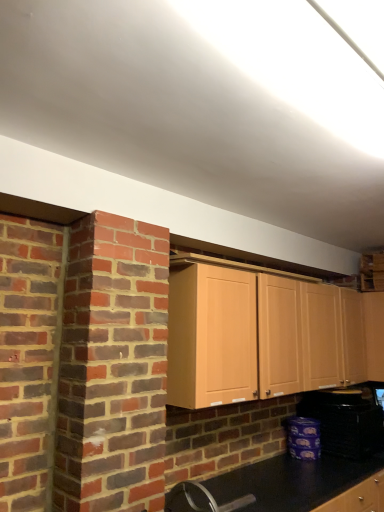
Question: Should I look upward or downward to see light wood cabinet at center?

Choices:
 (A) down
 (B) up

Answer: (A)

Question: Considering the relative sizes of light wood cabinet at center and black plastic toaster at lower right in the image provided, is light wood cabinet at center shorter than black plastic toaster at lower right?

Choices:
 (A) yes
 (B) no

Answer: (B)

Question: Is light wood cabinet at center aimed at black plastic toaster at lower right?

Choices:
 (A) no
 (B) yes

Answer: (A)

Question: From a real-world perspective, is light wood cabinet at center over black plastic toaster at lower right?

Choices:
 (A) yes
 (B) no

Answer: (A)

Question: Is light wood cabinet at center at the left side of black plastic toaster at lower right?

Choices:
 (A) no
 (B) yes

Answer: (B)

Question: Is light wood cabinet at center behind black plastic toaster at lower right?

Choices:
 (A) yes
 (B) no

Answer: (B)

Question: Is light wood cabinet at center oriented away from black plastic toaster at lower right?

Choices:
 (A) no
 (B) yes

Answer: (A)

Question: Can you confirm if black plastic toaster at lower right is thinner than light wood cabinet at center?

Choices:
 (A) yes
 (B) no

Answer: (B)

Question: Is the position of black plastic toaster at lower right more distant than that of light wood cabinet at center?

Choices:
 (A) no
 (B) yes

Answer: (B)

Question: From the image's perspective, does black plastic toaster at lower right appear lower than light wood cabinet at center?

Choices:
 (A) no
 (B) yes

Answer: (B)

Question: Is black plastic toaster at lower right positioned before light wood cabinet at center?

Choices:
 (A) yes
 (B) no

Answer: (B)

Question: Is the surface of black plastic toaster at lower right in direct contact with light wood cabinet at center?

Choices:
 (A) yes
 (B) no

Answer: (B)

Question: Does black plastic toaster at lower right have a lesser height compared to light wood cabinet at center?

Choices:
 (A) yes
 (B) no

Answer: (A)

Question: Relative to light wood cabinet at center, is black plastic toaster at lower right in front or behind?

Choices:
 (A) behind
 (B) front

Answer: (A)